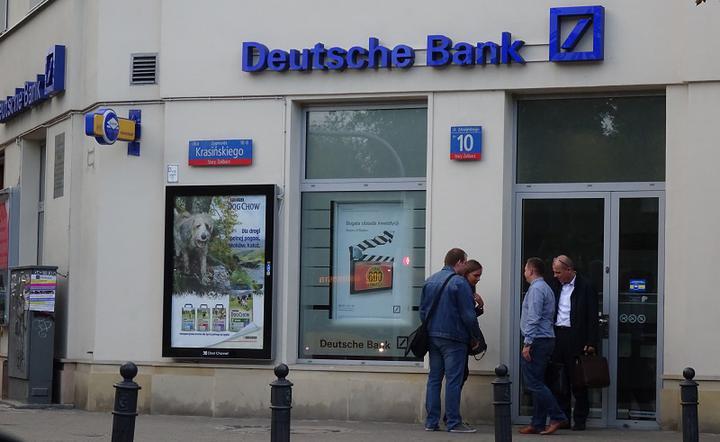
At what (x,y) coordinates should I click in order to perform the action: click on door. Please return your answer as a coordinate pair (x, y). This screenshot has width=720, height=442. Looking at the image, I should click on (580, 245).